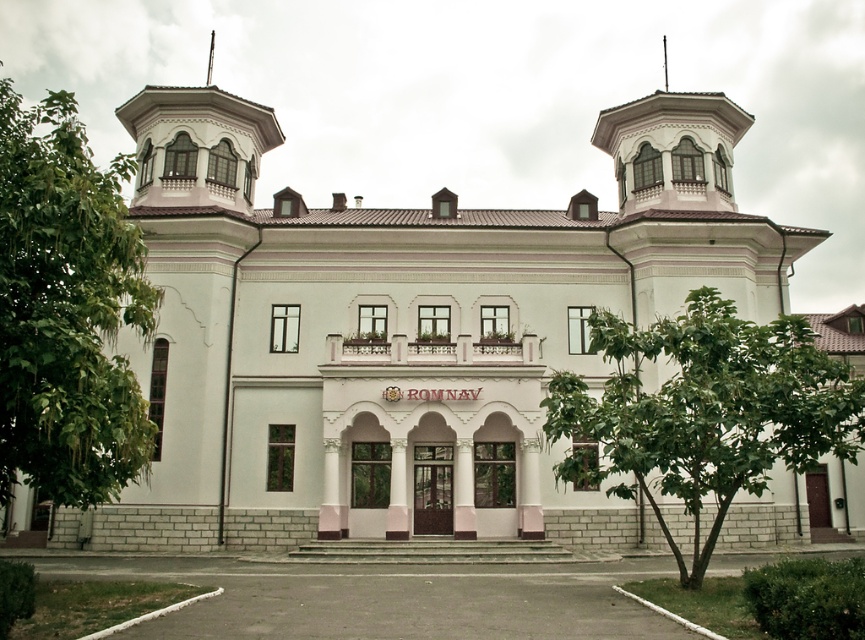
You are standing in front of the two story building and see the point marked at coordinate [67,310]. What is located at that point?

The point marked at coordinate [67,310] is where the green leafy tree at left is located.

You are standing in front of the two story building and notice two green leafy trees. Which tree has a wider spread of branches? The green leafy tree at left or the green leafy tree at center?

The green leafy tree at left has a wider spread of branches than the green leafy tree at center.

You are standing in front of the two story building and see the green leafy tree at left and the green leafy tree at center. Which tree is positioned more to the east?

The green leafy tree at left is positioned more to the east because it is to the left of the green leafy tree at center.